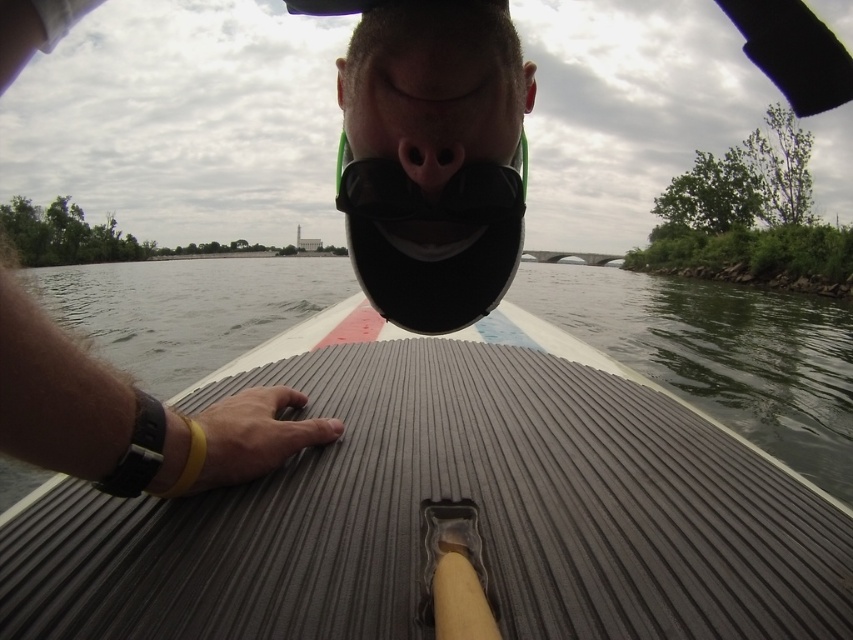
Question: Which point is closer to the camera?

Choices:
 (A) (550, 570)
 (B) (480, 72)
 (C) (424, 161)

Answer: (A)

Question: Which object appears farthest from the camera in this image?

Choices:
 (A) matte black mouth at center
 (B) matte black nose at center
 (C) gray ribbed paddleboard at center

Answer: (B)

Question: Does gray ribbed paddleboard at center appear on the left side of matte black nose at center?

Choices:
 (A) yes
 (B) no

Answer: (B)

Question: Can you confirm if matte black mouth at center is positioned to the left of matte black nose at center?

Choices:
 (A) yes
 (B) no

Answer: (B)

Question: Which point appears farthest from the camera in this image?

Choices:
 (A) click(x=424, y=100)
 (B) click(x=433, y=150)
 (C) click(x=593, y=547)

Answer: (B)

Question: Does gray ribbed paddleboard at center have a lesser width compared to matte black nose at center?

Choices:
 (A) yes
 (B) no

Answer: (B)